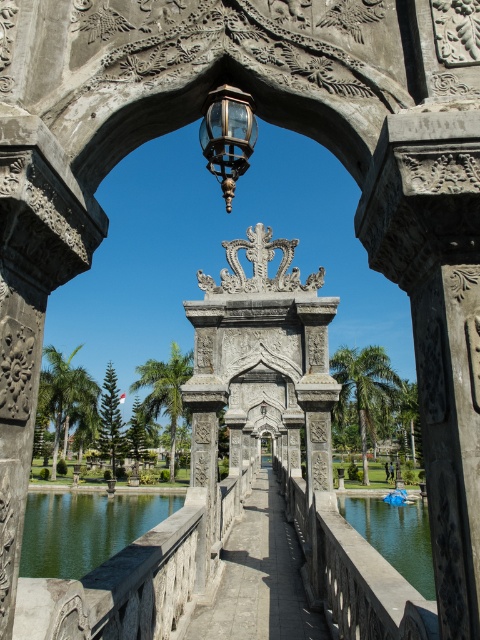
Is green reflective water at lower left to the right of green liquid water at bridge center from the viewer's perspective?

In fact, green reflective water at lower left is to the left of green liquid water at bridge center.

Who is more forward, [100,502] or [383,506]?

Point [383,506] is in front.

At what (x,y) coordinates should I click in order to perform the action: click on green reflective water at lower left. Please return your answer as a coordinate pair (x, y). Looking at the image, I should click on (84, 529).

Is green reflective water at lower left in front of matte glass lantern at center?

No, it is behind matte glass lantern at center.

Image resolution: width=480 pixels, height=640 pixels. Identify the location of green reflective water at lower left. (84, 529).

Which is behind, point (61, 573) or point (226, 154)?

Point (61, 573)

Find the location of a particular element. The width and height of the screenshot is (480, 640). green reflective water at lower left is located at coordinates (84, 529).

Does gray stone path at center appear over matte glass lantern at center?

Incorrect, gray stone path at center is not positioned above matte glass lantern at center.

Is gray stone path at center shorter than matte glass lantern at center?

Incorrect, gray stone path at center's height does not fall short of matte glass lantern at center's.

What do you see at coordinates (259, 577) in the screenshot?
I see `gray stone path at center` at bounding box center [259, 577].

This screenshot has width=480, height=640. In order to click on gray stone path at center in this screenshot , I will do `click(259, 577)`.